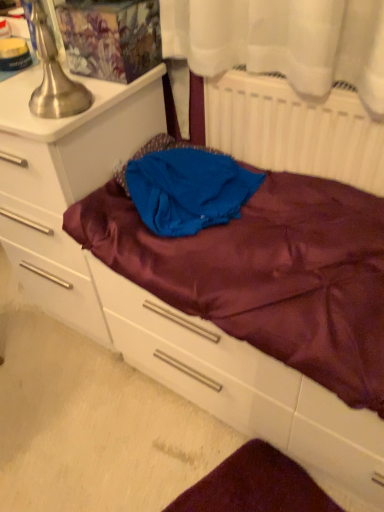
I want to click on white matte radiator at upper right, so click(x=294, y=129).

Can you confirm if brushed metal table lamp at upper left is positioned to the right of white matte radiator at upper right?

Incorrect, brushed metal table lamp at upper left is not on the right side of white matte radiator at upper right.

Who is bigger, brushed metal table lamp at upper left or white matte radiator at upper right?

white matte radiator at upper right.

From the picture: Is brushed metal table lamp at upper left oriented towards white matte radiator at upper right?

No, brushed metal table lamp at upper left does not turn towards white matte radiator at upper right.

Is brushed metal table lamp at upper left taller than white matte radiator at upper right?

No.

Considering their positions, is brushed metal table lamp at upper left located in front of or behind matte white chest of drawers at left?

In the image, brushed metal table lamp at upper left appears in front of matte white chest of drawers at left.

Is brushed metal table lamp at upper left positioned beyond the bounds of matte white chest of drawers at left?

Indeed, brushed metal table lamp at upper left is completely outside matte white chest of drawers at left.

Does brushed metal table lamp at upper left have a lesser height compared to matte white chest of drawers at left?

Yes.

From a real-world perspective, which is physically above, brushed metal table lamp at upper left or matte white chest of drawers at left?

brushed metal table lamp at upper left, from a real-world perspective.

Would you say matte white chest of drawers at left is a long distance from satin purple drawer at center?

matte white chest of drawers at left is actually quite close to satin purple drawer at center.

Measure the distance between matte white chest of drawers at left and satin purple drawer at center.

The distance of matte white chest of drawers at left from satin purple drawer at center is 13.29 inches.

Can you tell me how much matte white chest of drawers at left and satin purple drawer at center differ in facing direction?

The facing directions of matte white chest of drawers at left and satin purple drawer at center are 0.748 degrees apart.

Which of these two, matte white chest of drawers at left or satin purple drawer at center, is thinner?

Thinner between the two is satin purple drawer at center.

Is satin purple drawer at center wider than matte white chest of drawers at left?

Incorrect, the width of satin purple drawer at center does not surpass that of matte white chest of drawers at left.

Is satin purple drawer at center bigger than matte white chest of drawers at left?

No.

Is satin purple drawer at center situated inside matte white chest of drawers at left or outside?

satin purple drawer at center is not enclosed by matte white chest of drawers at left.

Is satin purple drawer at center with matte white chest of drawers at left?

satin purple drawer at center and matte white chest of drawers at left are not in contact.

Would you say blue satin cloth at center is a long distance from white matte radiator at upper right?

No, there isn't a large distance between blue satin cloth at center and white matte radiator at upper right.

Which point is more distant from viewer, (213, 212) or (321, 129)?

The point (213, 212) is farther.

Does blue satin cloth at center appear on the left side of white matte radiator at upper right?

Indeed, blue satin cloth at center is positioned on the left side of white matte radiator at upper right.

In terms of size, does blue satin cloth at center appear bigger or smaller than white matte radiator at upper right?

In the image, blue satin cloth at center appears to be smaller than white matte radiator at upper right.

Is white matte radiator at upper right next to blue satin cloth at center and touching it?

No, white matte radiator at upper right is not next to blue satin cloth at center.

Does white matte radiator at upper right have a greater width compared to blue satin cloth at center?

Incorrect, the width of white matte radiator at upper right does not surpass that of blue satin cloth at center.

Is white matte radiator at upper right facing away from blue satin cloth at center?

Absolutely, white matte radiator at upper right is directed away from blue satin cloth at center.

Considering the sizes of objects white matte radiator at upper right and blue satin cloth at center in the image provided, who is bigger, white matte radiator at upper right or blue satin cloth at center?

Bigger between the two is white matte radiator at upper right.

From the image's perspective, between blue satin cloth at center and matte white chest of drawers at left, who is located below?

blue satin cloth at center is shown below in the image.

Is blue satin cloth at center thinner than matte white chest of drawers at left?

Yes.

Image resolution: width=384 pixels, height=512 pixels. I want to click on clothing behind the matte white chest of drawers at left, so click(x=186, y=187).

Considering the positions of point (227, 221) and point (39, 127), is point (227, 221) closer or farther from the camera than point (39, 127)?

Point (227, 221).

This screenshot has height=512, width=384. I want to click on radiator on the right side of brushed metal table lamp at upper left, so click(x=294, y=129).

Locate an element on the screen. table lamp above the matte white chest of drawers at left (from the image's perspective) is located at coordinates (54, 77).

Considering their positions, is blue satin cloth at center positioned further to brushed metal table lamp at upper left than matte white chest of drawers at left?

The object further to brushed metal table lamp at upper left is blue satin cloth at center.

Looking at the image, which one is located further to matte white chest of drawers at left, blue satin cloth at center or white matte radiator at upper right?

white matte radiator at upper right lies further to matte white chest of drawers at left than the other object.

From the image, which object appears to be farther from white matte radiator at upper right, brushed metal table lamp at upper left or satin purple drawer at center?

satin purple drawer at center is further to white matte radiator at upper right.

When comparing their distances from brushed metal table lamp at upper left, does blue satin cloth at center or satin purple drawer at center seem further?

satin purple drawer at center.

Based on their spatial positions, is brushed metal table lamp at upper left or matte white chest of drawers at left further from white matte radiator at upper right?

Among the two, brushed metal table lamp at upper left is located further to white matte radiator at upper right.

Estimate the real-world distances between objects in this image. Which object is further from white matte radiator at upper right, blue satin cloth at center or brushed metal table lamp at upper left?

The object further to white matte radiator at upper right is brushed metal table lamp at upper left.

Considering their positions, is matte white chest of drawers at left positioned closer to blue satin cloth at center than satin purple drawer at center?

Among the two, matte white chest of drawers at left is located nearer to blue satin cloth at center.

From the image, which object appears to be farther from blue satin cloth at center, satin purple drawer at center or white matte radiator at upper right?

satin purple drawer at center.

Image resolution: width=384 pixels, height=512 pixels. In order to click on clothing situated between brushed metal table lamp at upper left and white matte radiator at upper right from left to right in this screenshot , I will do `click(186, 187)`.

Find the location of a particular element. This screenshot has height=512, width=384. drawer between matte white chest of drawers at left and white matte radiator at upper right in the horizontal direction is located at coordinates (244, 387).

Locate an element on the screen. The width and height of the screenshot is (384, 512). table lamp between matte white chest of drawers at left and satin purple drawer at center from left to right is located at coordinates (54, 77).

At what (x,y) coordinates should I click in order to perform the action: click on clothing between brushed metal table lamp at upper left and satin purple drawer at center from top to bottom. Please return your answer as a coordinate pair (x, y). Looking at the image, I should click on (186, 187).